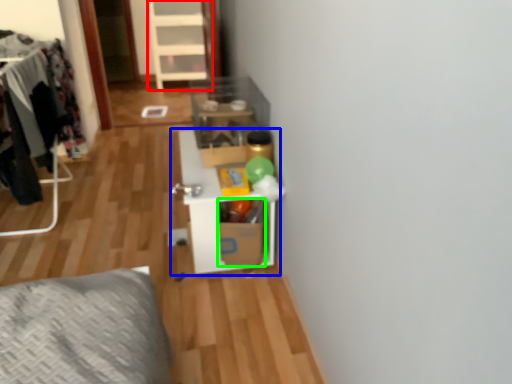
Question: Which object is positioned closest to dresser (highlighted by a red box)? Select from shelf (highlighted by a blue box) and cardboard box (highlighted by a green box).

Choices:
 (A) shelf
 (B) cardboard box

Answer: (A)